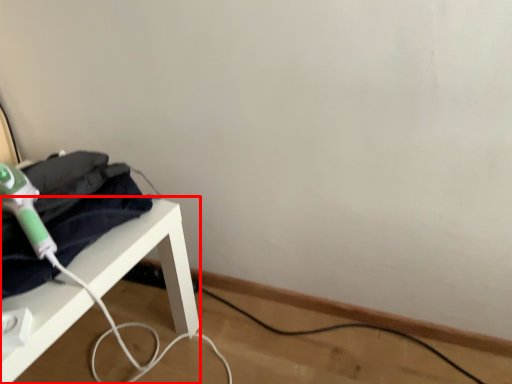
Question: From the image, what is the correct spatial relationship of furniture (annotated by the red box) in relation to hair drier?

Choices:
 (A) right
 (B) left

Answer: (B)